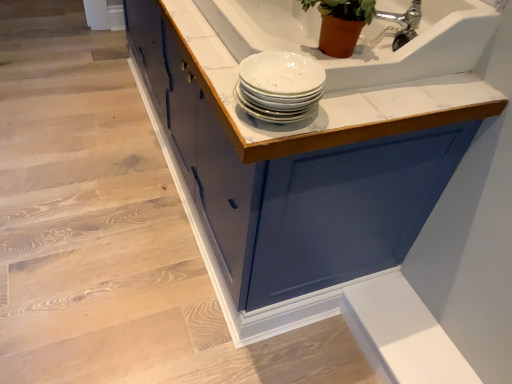
Identify the location of white glossy plates at upper center. (279, 86).

Locate an element on the screen. This screenshot has height=384, width=512. white glossy plates at upper center is located at coordinates (279, 86).

Identify the location of tableware in front of the white glossy countertop at upper center. The height and width of the screenshot is (384, 512). (279, 86).

Considering the sizes of white glossy plates at upper center and white glossy countertop at upper center in the image, is white glossy plates at upper center taller or shorter than white glossy countertop at upper center?

In the image, white glossy plates at upper center appears to be shorter than white glossy countertop at upper center.

In the scene shown: Is white glossy plates at upper center closer to the viewer compared to white glossy countertop at upper center?

Yes, the depth of white glossy plates at upper center is less than that of white glossy countertop at upper center.

Is white glossy plates at upper center far from white glossy countertop at upper center?

They are positioned close to each other.

Find the location of a particular element. cabinetry that is under the white glossy countertop at upper center (from a real-world perspective) is located at coordinates (305, 151).

Considering the positions of objects matte blue cabinet at upper center and white glossy countertop at upper center in the image provided, who is more to the right, matte blue cabinet at upper center or white glossy countertop at upper center?

Positioned to the right is white glossy countertop at upper center.

From a real-world perspective, relative to white glossy countertop at upper center, is matte blue cabinet at upper center vertically above or below?

matte blue cabinet at upper center is below white glossy countertop at upper center.

Looking at this image, does matte blue cabinet at upper center have a smaller size compared to white glossy countertop at upper center?

No, matte blue cabinet at upper center is not smaller than white glossy countertop at upper center.

Looking at this image, can you confirm if silver metallic faucet at upper right is shorter than matte blue cabinet at upper center?

Correct, silver metallic faucet at upper right is not as tall as matte blue cabinet at upper center.

Is matte blue cabinet at upper center a part of silver metallic faucet at upper right?

No, silver metallic faucet at upper right does not contain matte blue cabinet at upper center.

Is silver metallic faucet at upper right looking in the opposite direction of matte blue cabinet at upper center?

silver metallic faucet at upper right does not have its back to matte blue cabinet at upper center.

Can you confirm if white glossy countertop at upper center is positioned to the right of matte blue cabinet at upper center?

Yes, white glossy countertop at upper center is to the right of matte blue cabinet at upper center.

Is white glossy countertop at upper center behind matte blue cabinet at upper center?

Yes, it is.

How many degrees apart are the facing directions of white glossy countertop at upper center and matte blue cabinet at upper center?

The angle between the facing direction of white glossy countertop at upper center and the facing direction of matte blue cabinet at upper center is 0.647 degrees.

The width and height of the screenshot is (512, 384). I want to click on tableware in front of the white glossy countertop at upper center, so click(279, 86).

Is white glossy countertop at upper center outside of white glossy plates at upper center?

Absolutely, white glossy countertop at upper center is external to white glossy plates at upper center.

Is white glossy countertop at upper center touching white glossy plates at upper center?

white glossy countertop at upper center is not next to white glossy plates at upper center, and they're not touching.

Is white glossy countertop at upper center turned away from white glossy plates at upper center?

No, white glossy plates at upper center is not at the back of white glossy countertop at upper center.

Is white glossy plates at upper center behind silver metallic faucet at upper right?

No, white glossy plates at upper center is closer to the camera.

Are white glossy plates at upper center and silver metallic faucet at upper right making contact?

white glossy plates at upper center and silver metallic faucet at upper right are clearly separated.

Would you say white glossy plates at upper center is inside or outside silver metallic faucet at upper right?

white glossy plates at upper center is outside silver metallic faucet at upper right.

Who is taller, white glossy plates at upper center or silver metallic faucet at upper right?

With more height is silver metallic faucet at upper right.

Is white glossy plates at upper center positioned in front of matte blue cabinet at upper center?

Yes, the depth of white glossy plates at upper center is less than that of matte blue cabinet at upper center.

Is white glossy plates at upper center at the right side of matte blue cabinet at upper center?

Correct, you'll find white glossy plates at upper center to the right of matte blue cabinet at upper center.

This screenshot has width=512, height=384. Find the location of `countertop below the white glossy plates at upper center (from a real-world perspective)`. countertop below the white glossy plates at upper center (from a real-world perspective) is located at coordinates tap(324, 98).

Where is `cabinetry in front of the white glossy countertop at upper center`? The height and width of the screenshot is (384, 512). cabinetry in front of the white glossy countertop at upper center is located at coordinates (305, 151).

Based on their spatial positions, is matte blue cabinet at upper center or white glossy plates at upper center closer to silver metallic faucet at upper right?

white glossy plates at upper center lies closer to silver metallic faucet at upper right than the other object.

Looking at the image, which one is located closer to matte blue cabinet at upper center, white glossy plates at upper center or white glossy countertop at upper center?

white glossy countertop at upper center is positioned closer to the anchor matte blue cabinet at upper center.

From the image, which object appears to be farther from white glossy countertop at upper center, matte blue cabinet at upper center or silver metallic faucet at upper right?

silver metallic faucet at upper right is positioned further to the anchor white glossy countertop at upper center.

Estimate the real-world distances between objects in this image. Which object is further from white glossy plates at upper center, white glossy countertop at upper center or matte blue cabinet at upper center?

matte blue cabinet at upper center is positioned further to the anchor white glossy plates at upper center.

Estimate the real-world distances between objects in this image. Which object is closer to white glossy plates at upper center, matte blue cabinet at upper center or silver metallic faucet at upper right?

silver metallic faucet at upper right lies closer to white glossy plates at upper center than the other object.

When comparing their distances from matte blue cabinet at upper center, does silver metallic faucet at upper right or white glossy countertop at upper center seem further?

Among the two, silver metallic faucet at upper right is located further to matte blue cabinet at upper center.

Considering their positions, is matte blue cabinet at upper center positioned closer to white glossy countertop at upper center than white glossy plates at upper center?

Based on the image, white glossy plates at upper center appears to be nearer to white glossy countertop at upper center.

From the image, which object appears to be nearer to matte blue cabinet at upper center, white glossy countertop at upper center or silver metallic faucet at upper right?

white glossy countertop at upper center lies closer to matte blue cabinet at upper center than the other object.

Find the location of `countertop between matte blue cabinet at upper center and silver metallic faucet at upper right in the horizontal direction`. countertop between matte blue cabinet at upper center and silver metallic faucet at upper right in the horizontal direction is located at coordinates (324, 98).

Where is `tableware between matte blue cabinet at upper center and silver metallic faucet at upper right`? The height and width of the screenshot is (384, 512). tableware between matte blue cabinet at upper center and silver metallic faucet at upper right is located at coordinates (279, 86).

What are the coordinates of `countertop between matte blue cabinet at upper center and white glossy plates at upper center from top to bottom` in the screenshot? It's located at (324, 98).

You are a GUI agent. You are given a task and a screenshot of the screen. Output one action in this format:
    pyautogui.click(x=<x>, y=<y>)
    Task: Click on the tap that lies between white glossy countertop at upper center and white glossy plates at upper center from top to bottom
    
    Given the screenshot: What is the action you would take?
    pyautogui.click(x=400, y=25)